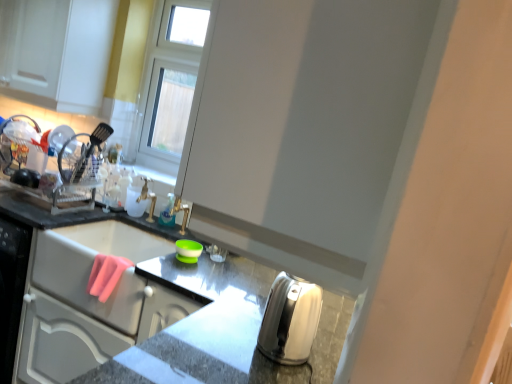
Question: Which direction should I rotate to face green rubber bowl at center, arranged as the first appliance when viewed from the left, — up or down?

Choices:
 (A) down
 (B) up

Answer: (A)

Question: Considering the relative sizes of white glossy cabinet at upper left and translucent plastic bottle at center in the image provided, is white glossy cabinet at upper left bigger than translucent plastic bottle at center?

Choices:
 (A) no
 (B) yes

Answer: (B)

Question: Is white glossy cabinet at upper left positioned beyond the bounds of translucent plastic bottle at center?

Choices:
 (A) no
 (B) yes

Answer: (B)

Question: Is white glossy cabinet at upper left facing towards translucent plastic bottle at center?

Choices:
 (A) yes
 (B) no

Answer: (B)

Question: From a real-world perspective, is white glossy cabinet at upper left under translucent plastic bottle at center?

Choices:
 (A) no
 (B) yes

Answer: (A)

Question: Is white glossy cabinet at upper left at the right side of translucent plastic bottle at center?

Choices:
 (A) yes
 (B) no

Answer: (B)

Question: Is white glossy cabinet at upper left positioned before translucent plastic bottle at center?

Choices:
 (A) no
 (B) yes

Answer: (B)

Question: Is satin silver toaster at lower right further to camera compared to white glossy sink at upper left?

Choices:
 (A) yes
 (B) no

Answer: (B)

Question: Is satin silver toaster at lower right wider than white glossy sink at upper left?

Choices:
 (A) no
 (B) yes

Answer: (B)

Question: Is satin silver toaster at lower right positioned with its back to white glossy sink at upper left?

Choices:
 (A) no
 (B) yes

Answer: (A)

Question: From the image's perspective, is satin silver toaster at lower right under white glossy sink at upper left?

Choices:
 (A) no
 (B) yes

Answer: (B)

Question: Does satin silver toaster at lower right have a lesser width compared to white glossy sink at upper left?

Choices:
 (A) no
 (B) yes

Answer: (A)

Question: Is there a large distance between satin silver toaster at lower right and white glossy sink at upper left?

Choices:
 (A) yes
 (B) no

Answer: (B)

Question: Can you confirm if satin silver kettle at lower right, positioned as the 2th appliance in back-to-front order, is smaller than translucent plastic bottle at center?

Choices:
 (A) no
 (B) yes

Answer: (A)